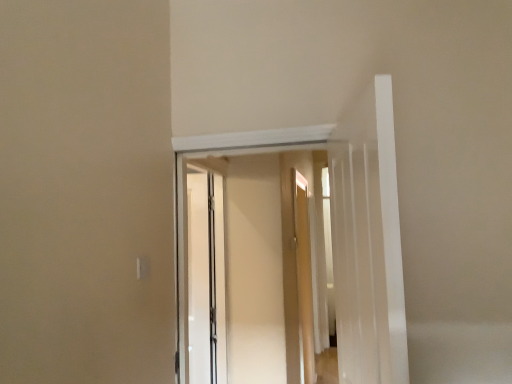
Question: Does clear glass screen door at center have a lesser width compared to white glossy door at upper center?

Choices:
 (A) yes
 (B) no

Answer: (A)

Question: Is clear glass screen door at center positioned in front of white glossy door at upper center?

Choices:
 (A) no
 (B) yes

Answer: (A)

Question: From a real-world perspective, is clear glass screen door at center beneath white glossy door at upper center?

Choices:
 (A) no
 (B) yes

Answer: (B)

Question: Is clear glass screen door at center positioned beyond the bounds of white glossy door at upper center?

Choices:
 (A) no
 (B) yes

Answer: (B)

Question: From the image's perspective, is clear glass screen door at center under white glossy door at upper center?

Choices:
 (A) no
 (B) yes

Answer: (B)

Question: Is clear glass screen door at center facing away from white glossy door at upper center?

Choices:
 (A) no
 (B) yes

Answer: (A)

Question: Considering the relative sizes of white glossy door at upper center and clear glass screen door at center in the image provided, is white glossy door at upper center taller than clear glass screen door at center?

Choices:
 (A) no
 (B) yes

Answer: (A)

Question: From the image's perspective, is white glossy door at upper center on clear glass screen door at center?

Choices:
 (A) yes
 (B) no

Answer: (A)

Question: Is white glossy door at upper center located outside clear glass screen door at center?

Choices:
 (A) yes
 (B) no

Answer: (A)

Question: Considering the relative sizes of white glossy door at upper center and clear glass screen door at center in the image provided, is white glossy door at upper center thinner than clear glass screen door at center?

Choices:
 (A) no
 (B) yes

Answer: (A)

Question: Can you confirm if white glossy door at upper center is wider than clear glass screen door at center?

Choices:
 (A) no
 (B) yes

Answer: (B)

Question: From the image's perspective, is white glossy door at upper center located beneath clear glass screen door at center?

Choices:
 (A) yes
 (B) no

Answer: (B)

Question: From the image's perspective, relative to clear glass screen door at center, is white glossy door at upper center above or below?

Choices:
 (A) below
 (B) above

Answer: (B)